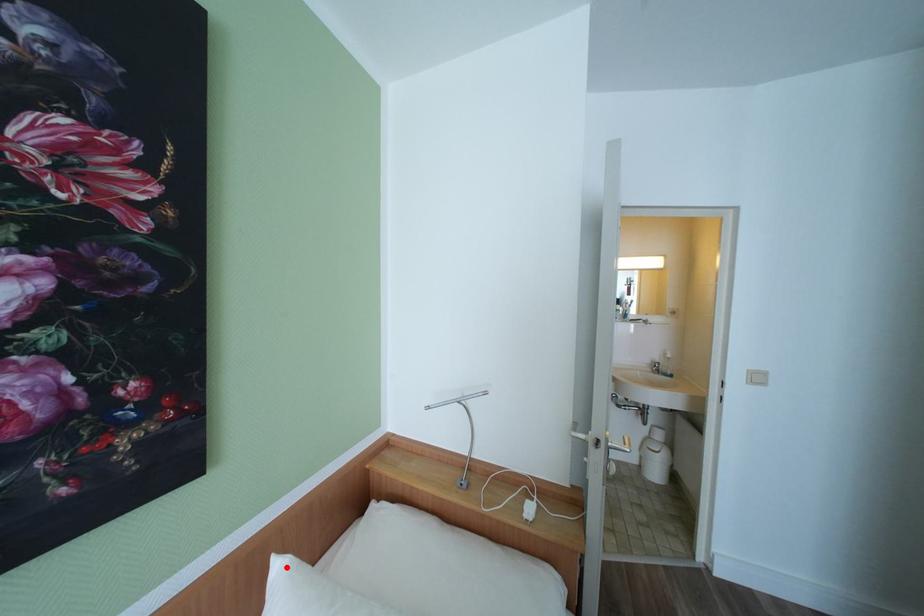
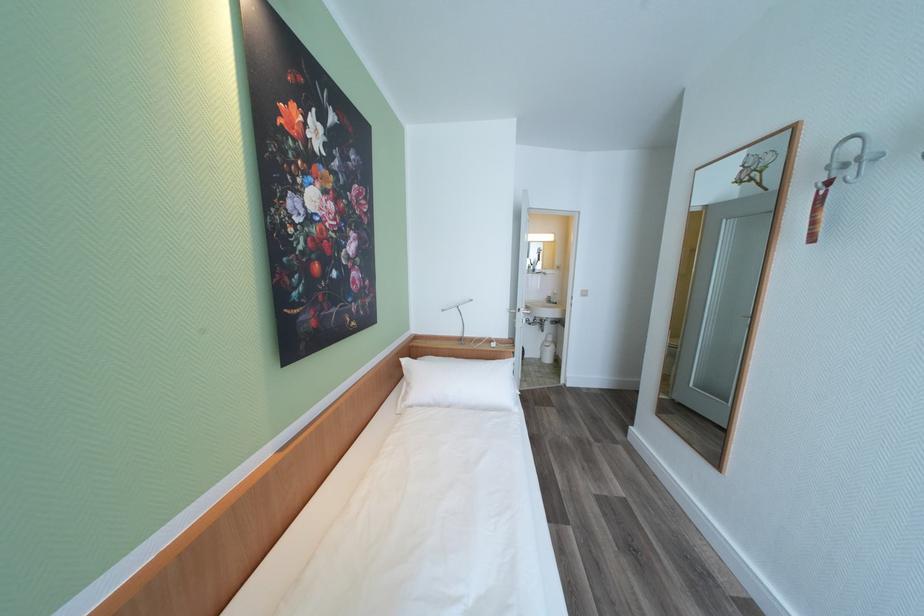
Where in the second image is the point corresponding to the highlighted location from the first image?

(411, 362)